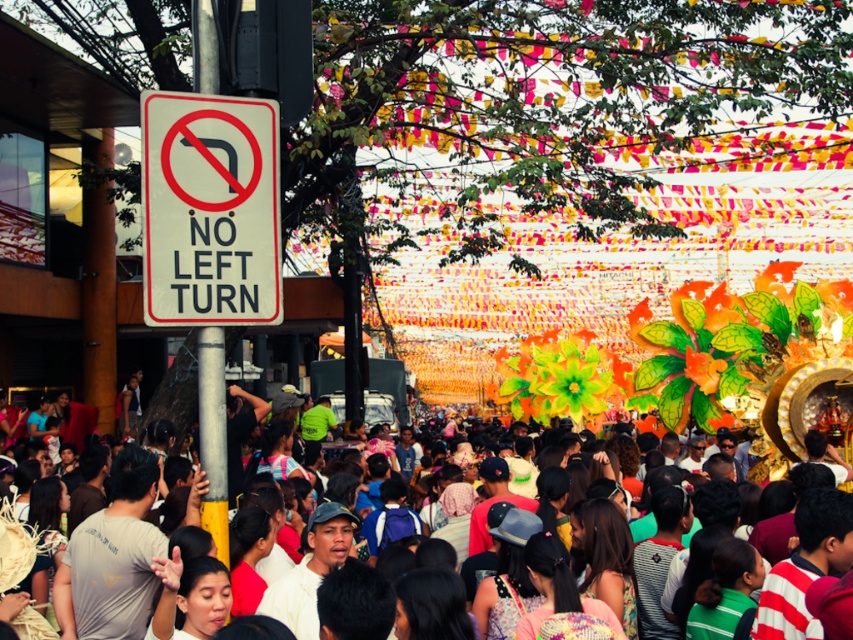
Is white plastic sign at upper left further to camera compared to multicolored fabric crowd at center?

No, it is in front of multicolored fabric crowd at center.

Between point (276, 177) and point (828, 449), which one is positioned behind?

The point (828, 449) is behind.

At what (x,y) coordinates should I click in order to perform the action: click on white plastic sign at upper left. Please return your answer as a coordinate pair (x, y). This screenshot has width=853, height=640. Looking at the image, I should click on (210, 209).